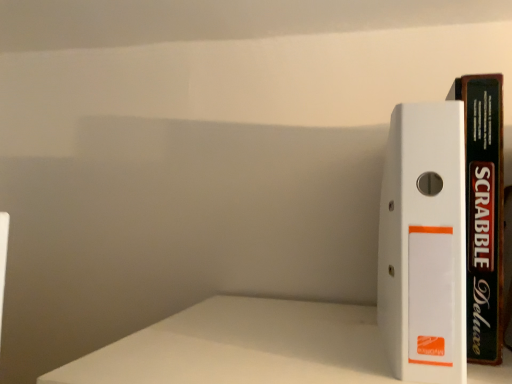
Describe the element at coordinates (483, 213) in the screenshot. I see `black matte scrabble deluxe at right, the 2th book in the left-to-right sequence` at that location.

You are a GUI agent. You are given a task and a screenshot of the screen. Output one action in this format:
    pyautogui.click(x=<x>, y=<y>)
    Task: Click on the black matte scrabble deluxe at right, the 2th book in the left-to-right sequence
    The width and height of the screenshot is (512, 384).
    Given the screenshot: What is the action you would take?
    pyautogui.click(x=483, y=213)

What do you see at coordinates (424, 244) in the screenshot? I see `white plastic binder at right, which is counted as the first book, starting from the left` at bounding box center [424, 244].

Image resolution: width=512 pixels, height=384 pixels. Find the location of `white plastic binder at right, which is counted as the first book, starting from the left`. white plastic binder at right, which is counted as the first book, starting from the left is located at coordinates click(x=424, y=244).

Identify the location of black matte scrabble deluxe at right, which is counted as the first book, starting from the right. (483, 213).

Does black matte scrabble deluxe at right, the 2th book in the left-to-right sequence, appear on the left side of white plastic binder at right, the 2th book positioned from the right?

No, black matte scrabble deluxe at right, the 2th book in the left-to-right sequence, is not to the left of white plastic binder at right, the 2th book positioned from the right.

Which object is further away from the camera, black matte scrabble deluxe at right, which is counted as the first book, starting from the right, or white plastic binder at right, which is counted as the first book, starting from the left?

Positioned behind is black matte scrabble deluxe at right, which is counted as the first book, starting from the right.

Looking at this image, which is further, (470, 181) or (418, 343)?

The point (470, 181) is more distant.

From the image's perspective, which is below, black matte scrabble deluxe at right, which is counted as the first book, starting from the right, or white plastic binder at right, the 2th book positioned from the right?

white plastic binder at right, the 2th book positioned from the right, from the image's perspective.

From a real-world perspective, is black matte scrabble deluxe at right, the 2th book in the left-to-right sequence, on white plastic binder at right, the 2th book positioned from the right?

Correct, in the physical world, black matte scrabble deluxe at right, the 2th book in the left-to-right sequence, is higher than white plastic binder at right, the 2th book positioned from the right.

Looking at their sizes, would you say black matte scrabble deluxe at right, the 2th book in the left-to-right sequence, is wider or thinner than white plastic binder at right, the 2th book positioned from the right?

Clearly, black matte scrabble deluxe at right, the 2th book in the left-to-right sequence, has less width compared to white plastic binder at right, the 2th book positioned from the right.

Can you confirm if black matte scrabble deluxe at right, the 2th book in the left-to-right sequence, is taller than white plastic binder at right, the 2th book positioned from the right?

Indeed, black matte scrabble deluxe at right, the 2th book in the left-to-right sequence, has a greater height compared to white plastic binder at right, the 2th book positioned from the right.

Looking at the image, does black matte scrabble deluxe at right, the 2th book in the left-to-right sequence, seem bigger or smaller compared to white plastic binder at right, which is counted as the first book, starting from the left?

Clearly, black matte scrabble deluxe at right, the 2th book in the left-to-right sequence, is smaller in size than white plastic binder at right, which is counted as the first book, starting from the left.

Do you think black matte scrabble deluxe at right, which is counted as the first book, starting from the right, is within white plastic binder at right, the 2th book positioned from the right, or outside of it?

black matte scrabble deluxe at right, which is counted as the first book, starting from the right, is not enclosed by white plastic binder at right, the 2th book positioned from the right.

Are black matte scrabble deluxe at right, which is counted as the first book, starting from the right, and white plastic binder at right, the 2th book positioned from the right, located far from each other?

No, black matte scrabble deluxe at right, which is counted as the first book, starting from the right, is not far away from white plastic binder at right, the 2th book positioned from the right.

Is black matte scrabble deluxe at right, which is counted as the first book, starting from the right, oriented towards white plastic binder at right, the 2th book positioned from the right?

No.

How different are the orientations of black matte scrabble deluxe at right, which is counted as the first book, starting from the right, and white plastic binder at right, the 2th book positioned from the right, in degrees?

0.000749 degrees separate the facing orientations of black matte scrabble deluxe at right, which is counted as the first book, starting from the right, and white plastic binder at right, the 2th book positioned from the right.

Locate an element on the screen. book behind the white plastic binder at right, which is counted as the first book, starting from the left is located at coordinates (483, 213).

Looking at this image, is white plastic binder at right, which is counted as the first book, starting from the left, to the left or to the right of black matte scrabble deluxe at right, which is counted as the first book, starting from the right, in the image?

Based on their positions, white plastic binder at right, which is counted as the first book, starting from the left, is located to the left of black matte scrabble deluxe at right, which is counted as the first book, starting from the right.

Which object is closer to the camera taking this photo, white plastic binder at right, the 2th book positioned from the right, or black matte scrabble deluxe at right, which is counted as the first book, starting from the right?

white plastic binder at right, the 2th book positioned from the right, is in front.

Does point (440, 134) come closer to viewer compared to point (483, 134)?

Yes, it is in front of point (483, 134).

Based on the photo, from the image's perspective, would you say white plastic binder at right, which is counted as the first book, starting from the left, is positioned over black matte scrabble deluxe at right, which is counted as the first book, starting from the right?

No, from the image's perspective, white plastic binder at right, which is counted as the first book, starting from the left, is not on top of black matte scrabble deluxe at right, which is counted as the first book, starting from the right.

From a real-world perspective, is white plastic binder at right, which is counted as the first book, starting from the left, positioned above or below black matte scrabble deluxe at right, the 2th book in the left-to-right sequence?

In terms of real-world spatial position, white plastic binder at right, which is counted as the first book, starting from the left, is below black matte scrabble deluxe at right, the 2th book in the left-to-right sequence.

Considering the sizes of white plastic binder at right, the 2th book positioned from the right, and black matte scrabble deluxe at right, the 2th book in the left-to-right sequence, in the image, is white plastic binder at right, the 2th book positioned from the right, wider or thinner than black matte scrabble deluxe at right, the 2th book in the left-to-right sequence,?

In the image, white plastic binder at right, the 2th book positioned from the right, appears to be wider than black matte scrabble deluxe at right, the 2th book in the left-to-right sequence.

Is white plastic binder at right, which is counted as the first book, starting from the left, taller than black matte scrabble deluxe at right, which is counted as the first book, starting from the right?

No, white plastic binder at right, which is counted as the first book, starting from the left, is not taller than black matte scrabble deluxe at right, which is counted as the first book, starting from the right.

Who is bigger, white plastic binder at right, which is counted as the first book, starting from the left, or black matte scrabble deluxe at right, the 2th book in the left-to-right sequence?

white plastic binder at right, which is counted as the first book, starting from the left, is bigger.

Can black matte scrabble deluxe at right, which is counted as the first book, starting from the right, be found inside white plastic binder at right, which is counted as the first book, starting from the left?

Actually, black matte scrabble deluxe at right, which is counted as the first book, starting from the right, is outside white plastic binder at right, which is counted as the first book, starting from the left.

Is white plastic binder at right, the 2th book positioned from the right, touching black matte scrabble deluxe at right, which is counted as the first book, starting from the right?

Result: Yes, the surface of white plastic binder at right, the 2th book positioned from the right, is in contact with black matte scrabble deluxe at right, which is counted as the first book, starting from the right.

Is white plastic binder at right, the 2th book positioned from the right, looking in the opposite direction of black matte scrabble deluxe at right, which is counted as the first book, starting from the right?

No, white plastic binder at right, the 2th book positioned from the right, is not facing the opposite direction of black matte scrabble deluxe at right, which is counted as the first book, starting from the right.

How far apart are white plastic binder at right, which is counted as the first book, starting from the left, and black matte scrabble deluxe at right, which is counted as the first book, starting from the right?

white plastic binder at right, which is counted as the first book, starting from the left, is 3.44 inches from black matte scrabble deluxe at right, which is counted as the first book, starting from the right.

Identify the location of book behind the white plastic binder at right, the 2th book positioned from the right. (483, 213).

This screenshot has width=512, height=384. What are the coordinates of `book above the white plastic binder at right, which is counted as the first book, starting from the left (from the image's perspective)` in the screenshot? It's located at (483, 213).

You are a GUI agent. You are given a task and a screenshot of the screen. Output one action in this format:
    pyautogui.click(x=<x>, y=<y>)
    Task: Click on the book below the black matte scrabble deluxe at right, the 2th book in the left-to-right sequence (from the image's perspective)
    
    Given the screenshot: What is the action you would take?
    pyautogui.click(x=424, y=244)